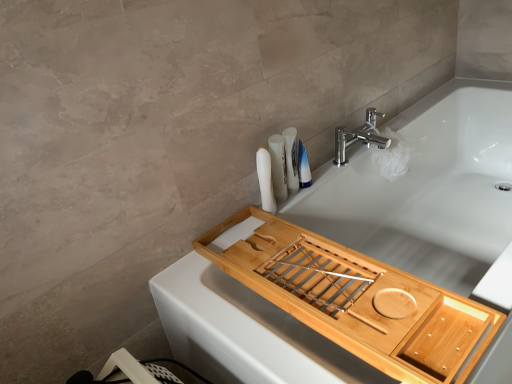
Question: Based on their sizes in the image, would you say white matte bathtub at upper center is bigger or smaller than white matte toothbrushes at upper right, positioned as the 2th toiletry in left-to-right order?

Choices:
 (A) small
 (B) big

Answer: (B)

Question: Is white matte bathtub at upper center to the left or to the right of white matte toothbrushes at upper right, positioned as the 2th toiletry in left-to-right order, in the image?

Choices:
 (A) right
 (B) left

Answer: (A)

Question: Which object is the closest to the blue glossy bottle at upper right, which appears as the first toiletry when viewed from the right?

Choices:
 (A) chrome/metallic faucet at upper right
 (B) white matte bathtub at upper center
 (C) natural wood tray at upper right
 (D) white matte tube at upper right, the 1th toiletry positioned from the left
 (E) white matte toothbrushes at upper right, positioned as the 2th toiletry in left-to-right order

Answer: (E)

Question: Estimate the real-world distances between objects in this image. Which object is closer to the chrome/metallic faucet at upper right?

Choices:
 (A) white matte tube at upper right, the 3th toiletry from the right
 (B) blue glossy bottle at upper right, which appears as the first toiletry when viewed from the right
 (C) natural wood tray at upper right
 (D) white matte bathtub at upper center
 (E) white matte toothbrushes at upper right, arranged as the 2th toiletry when viewed from the right

Answer: (B)